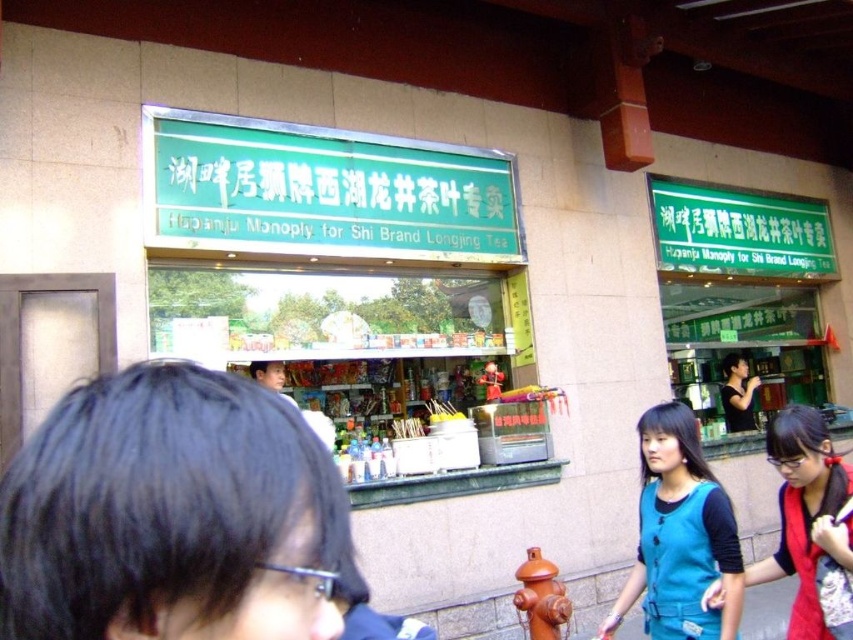
Does smooth black hair at center appear on the right side of black matte shirt at center?

In fact, smooth black hair at center is to the left of black matte shirt at center.

Is smooth black hair at center below black matte shirt at center?

Actually, smooth black hair at center is above black matte shirt at center.

You are a GUI agent. You are given a task and a screenshot of the screen. Output one action in this format:
    pyautogui.click(x=<x>, y=<y>)
    Task: Click on the smooth black hair at center
    
    Given the screenshot: What is the action you would take?
    pyautogui.click(x=170, y=515)

Which is above, orange matte hydrant at lower center or black matte shirt at center?

black matte shirt at center is higher up.

Does orange matte hydrant at lower center have a greater width compared to black matte shirt at center?

No.

Identify the location of orange matte hydrant at lower center. The width and height of the screenshot is (853, 640). (541, 596).

You are a GUI agent. You are given a task and a screenshot of the screen. Output one action in this format:
    pyautogui.click(x=<x>, y=<y>)
    Task: Click on the teal fabric vest at center
    The image size is (853, 640).
    Given the screenshot: What is the action you would take?
    pyautogui.click(x=680, y=534)

Can you confirm if teal fabric vest at center is taller than orange matte hydrant at lower center?

Indeed, teal fabric vest at center has a greater height compared to orange matte hydrant at lower center.

Between point (688, 467) and point (550, 577), which one is positioned in front?

Point (688, 467) is more forward.

Locate an element on the screen. This screenshot has height=640, width=853. teal fabric vest at center is located at coordinates (680, 534).